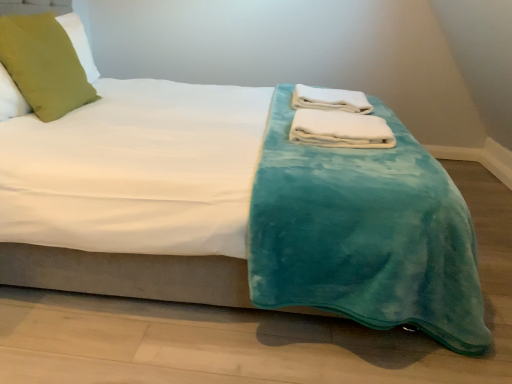
Question: Is green fabric pillow at upper left with white soft towel at center, the second bath towel from the front?

Choices:
 (A) no
 (B) yes

Answer: (A)

Question: From a real-world perspective, is green fabric pillow at upper left on top of white soft towel at center, positioned as the 1th bath towel in top-to-bottom order?

Choices:
 (A) yes
 (B) no

Answer: (A)

Question: Can you confirm if green fabric pillow at upper left is positioned to the left of white soft towel at center, the 2th bath towel positioned from the bottom?

Choices:
 (A) yes
 (B) no

Answer: (A)

Question: Would you consider green fabric pillow at upper left to be distant from white soft towel at center, the second bath towel from the front?

Choices:
 (A) yes
 (B) no

Answer: (A)

Question: Considering the relative sizes of green fabric pillow at upper left and white soft towel at center, the second bath towel from the front, in the image provided, is green fabric pillow at upper left shorter than white soft towel at center, the second bath towel from the front,?

Choices:
 (A) yes
 (B) no

Answer: (B)

Question: Is white soft towel at center, the first bath towel positioned from the back, bigger or smaller than white soft towel at center, positioned as the first bath towel in front-to-back order?

Choices:
 (A) small
 (B) big

Answer: (B)

Question: Considering the positions of white soft towel at center, the first bath towel positioned from the back, and white soft towel at center, which appears as the 2th bath towel when viewed from the top, in the image, is white soft towel at center, the first bath towel positioned from the back, taller or shorter than white soft towel at center, which appears as the 2th bath towel when viewed from the top,?

Choices:
 (A) short
 (B) tall

Answer: (B)

Question: Would you say white soft towel at center, the second bath towel from the front, is to the left or to the right of white soft towel at center, positioned as the first bath towel in front-to-back order, in the picture?

Choices:
 (A) right
 (B) left

Answer: (A)

Question: Considering their positions, is white soft towel at center, the first bath towel positioned from the back, located in front of or behind white soft towel at center, positioned as the first bath towel in front-to-back order?

Choices:
 (A) front
 (B) behind

Answer: (B)

Question: Based on their positions, is white soft towel at center, positioned as the first bath towel in front-to-back order, located to the left or right of green fabric pillow at upper left?

Choices:
 (A) right
 (B) left

Answer: (A)

Question: In terms of height, does white soft towel at center, positioned as the first bath towel in front-to-back order, look taller or shorter compared to green fabric pillow at upper left?

Choices:
 (A) tall
 (B) short

Answer: (B)

Question: Relative to green fabric pillow at upper left, is white soft towel at center, which appears as the 2th bath towel when viewed from the top, in front or behind?

Choices:
 (A) behind
 (B) front

Answer: (B)

Question: From a real-world perspective, relative to green fabric pillow at upper left, is white soft towel at center, positioned as the first bath towel in front-to-back order, vertically above or below?

Choices:
 (A) below
 (B) above

Answer: (A)

Question: Choose the correct answer: Is green fabric pillow at upper left inside white soft towel at center, the second bath towel from the front, or outside it?

Choices:
 (A) inside
 (B) outside

Answer: (B)

Question: Is point (1, 104) closer or farther from the camera than point (298, 107)?

Choices:
 (A) closer
 (B) farther

Answer: (A)